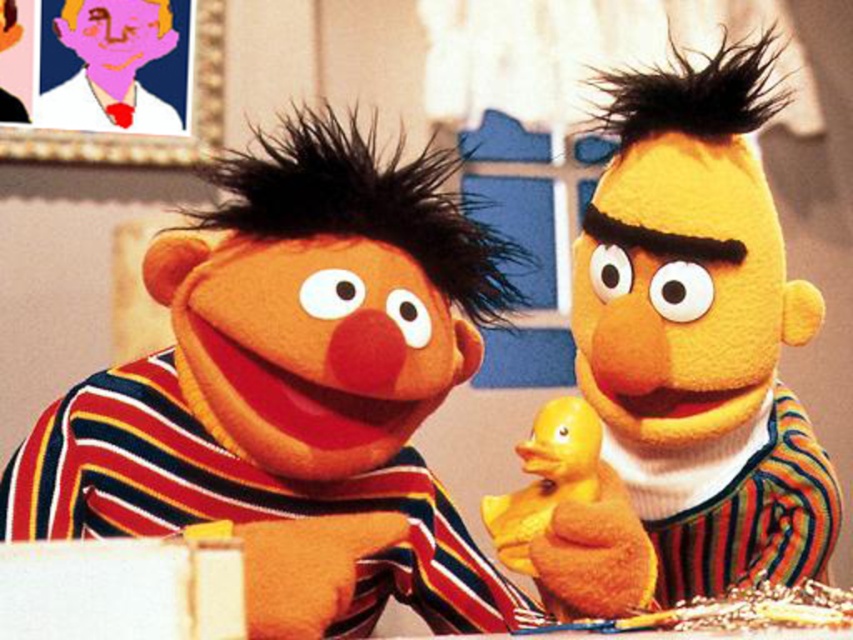
You are organizing a toy drive and need to fit the matte cardboard box at left and the yellow plush duck at right into a storage container. Which object requires more horizontal space to store?

The matte cardboard box at left requires more horizontal space because its width is larger than the yellow plush duck at right.